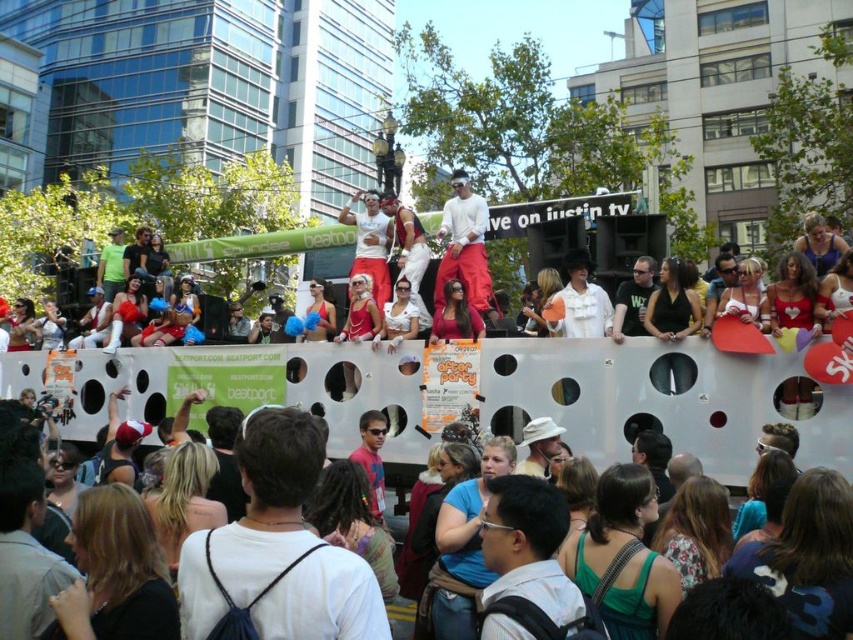
You are a photographer trying to capture a clear shot of the stage from the front row. You notice a white matte backpack at center and a matte white crowd at center blocking your view. Which object is shorter and can be easily moved to improve your vantage point?

The white matte backpack at center is shorter than the matte white crowd at center, so moving it would help improve your vantage point.